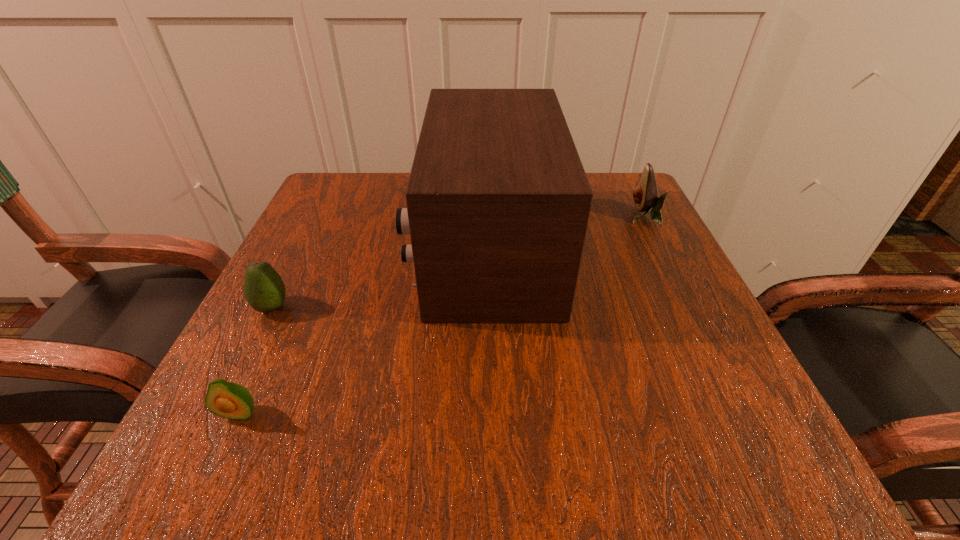
Where is `the tallest object`? The height and width of the screenshot is (540, 960). the tallest object is located at coordinates (498, 202).

Where is `the second object from right to left`? The image size is (960, 540). the second object from right to left is located at coordinates (498, 202).

Image resolution: width=960 pixels, height=540 pixels. Find the location of `the third shortest object`. the third shortest object is located at coordinates 645,194.

The height and width of the screenshot is (540, 960). I want to click on the farthest avocado, so tap(645, 194).

At what (x,y) coordinates should I click in order to perform the action: click on the second nearest avocado. Please return your answer as a coordinate pair (x, y). Looking at the image, I should click on (264, 289).

Identify the location of the nearest avocado. The width and height of the screenshot is (960, 540). (229, 400).

Identify the location of free spot located on the front-facing side of the tallest object. This screenshot has height=540, width=960. (383, 248).

I want to click on blank space located on the front-facing side of the tallest object, so click(x=378, y=248).

Locate an element on the screen. This screenshot has width=960, height=540. vacant space situated 0.180m on the front-facing side of the tallest object is located at coordinates (328, 248).

Identify the location of blank area located on the seed side of the rightmost avocado. The width and height of the screenshot is (960, 540). (507, 217).